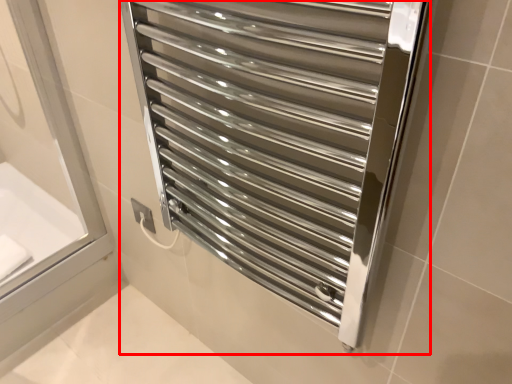
Question: Considering the relative positions of towel rack (annotated by the red box) and bath in the image provided, where is towel rack (annotated by the red box) located with respect to the staircase?

Choices:
 (A) left
 (B) right

Answer: (B)